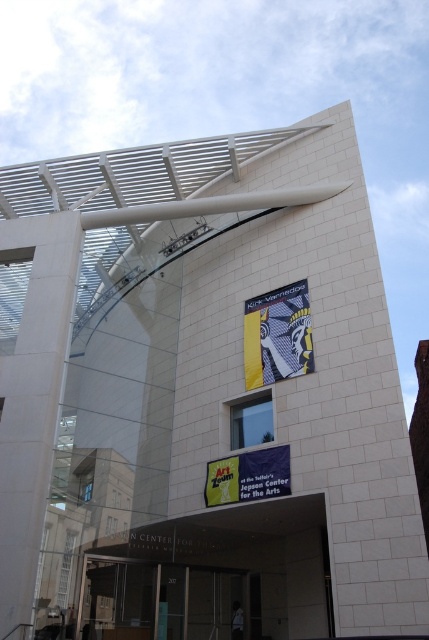
Question: Can you confirm if abstract patterned fabric at center is thinner than yellow fabric banner at center?

Choices:
 (A) no
 (B) yes

Answer: (A)

Question: Does white concrete pillar at left appear over abstract patterned fabric at center?

Choices:
 (A) no
 (B) yes

Answer: (A)

Question: Can you confirm if abstract patterned fabric at center is wider than yellow fabric banner at center?

Choices:
 (A) no
 (B) yes

Answer: (B)

Question: Which point appears closest to the camera in this image?

Choices:
 (A) (260, 476)
 (B) (257, 298)

Answer: (A)

Question: Which point is closer to the camera?

Choices:
 (A) (205, 490)
 (B) (311, 355)

Answer: (B)

Question: Which object is closer to the camera taking this photo?

Choices:
 (A) yellow fabric banner at center
 (B) white concrete pillar at left

Answer: (B)